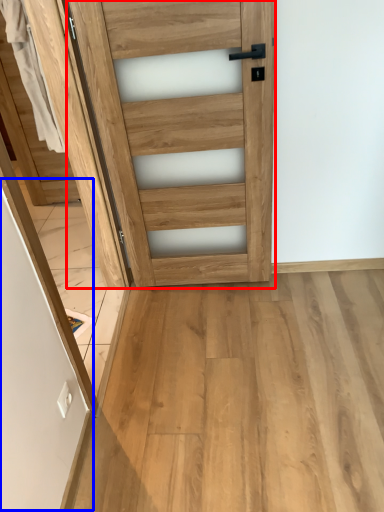
Question: Which point is closer to the camera, door (highlighted by a red box) or screen door (highlighted by a blue box)?

Choices:
 (A) door
 (B) screen door

Answer: (A)